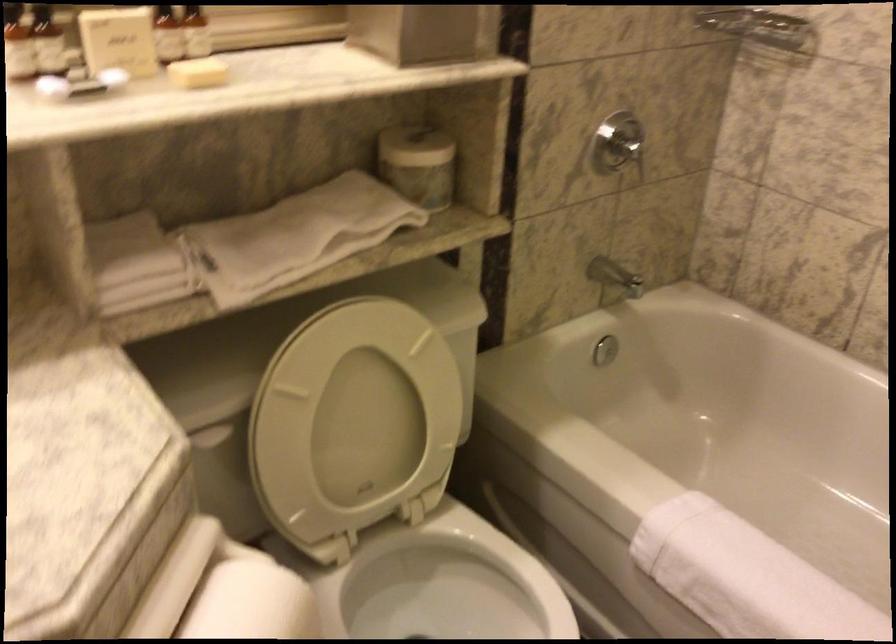
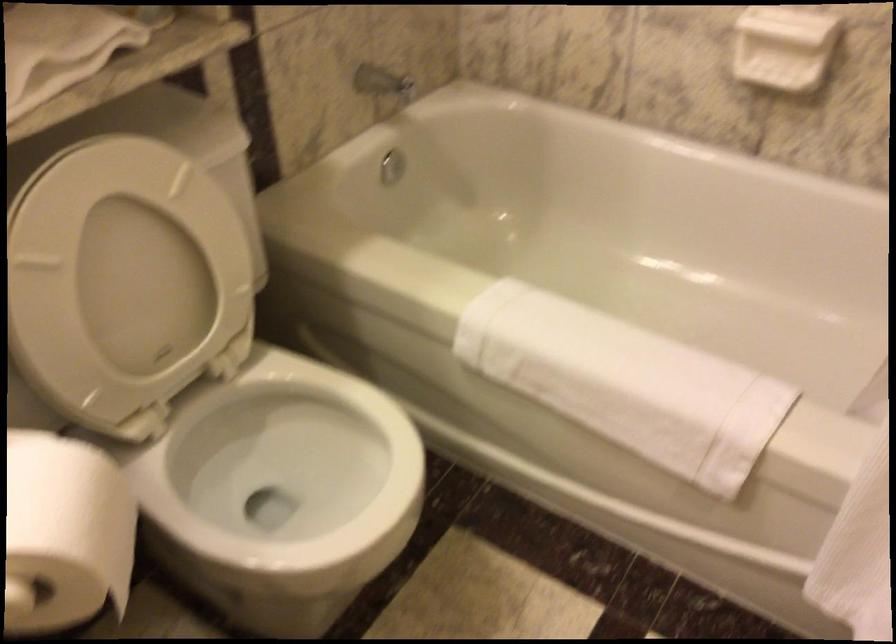
The point at (357, 404) is marked in the first image. Where is the corresponding point in the second image?

(126, 266)